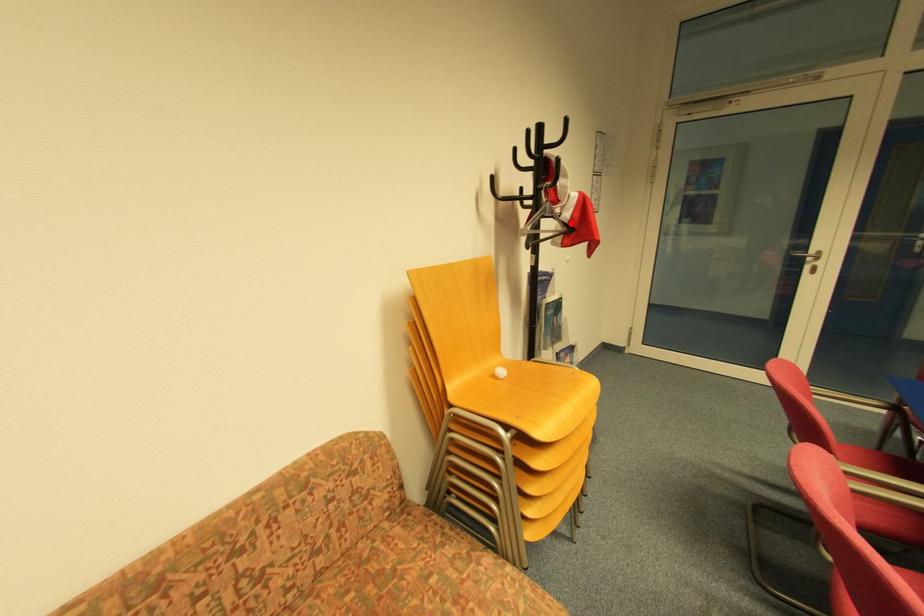
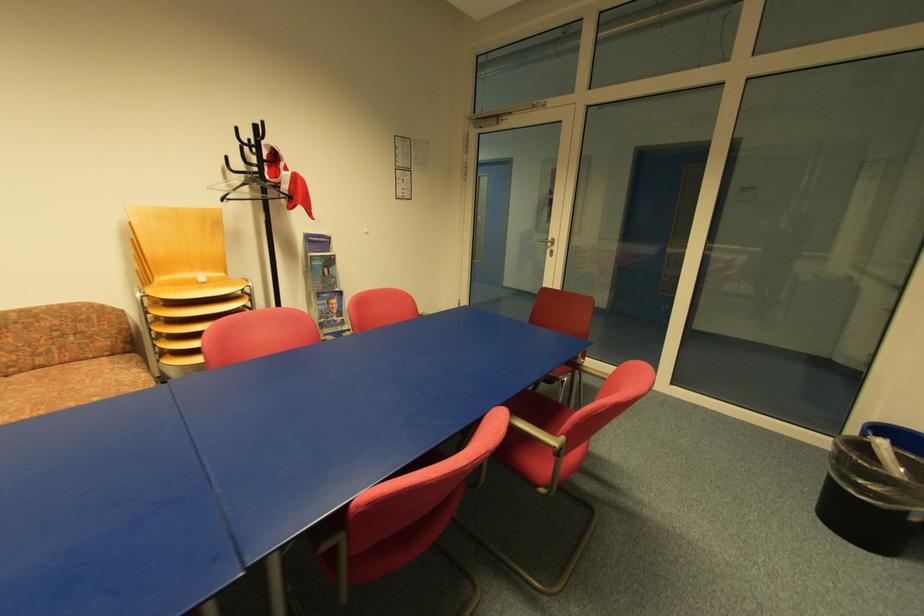
Find the pixel in the second image that matches the highlighted location in the first image.

(292, 193)